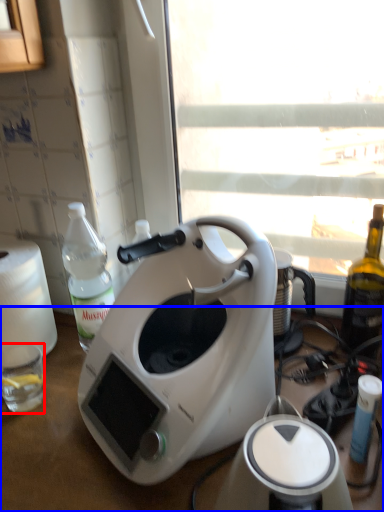
Question: Which of the following is the farthest to the observer, coffee cup (highlighted by a red box) or table (highlighted by a blue box)?

Choices:
 (A) coffee cup
 (B) table

Answer: (A)